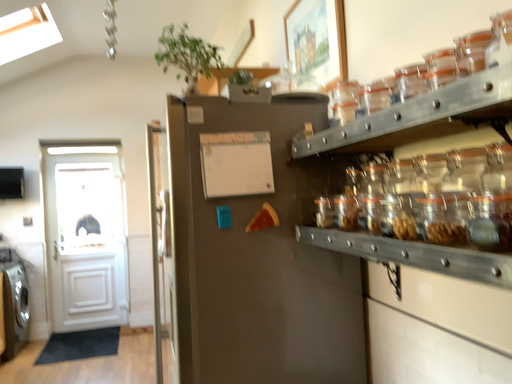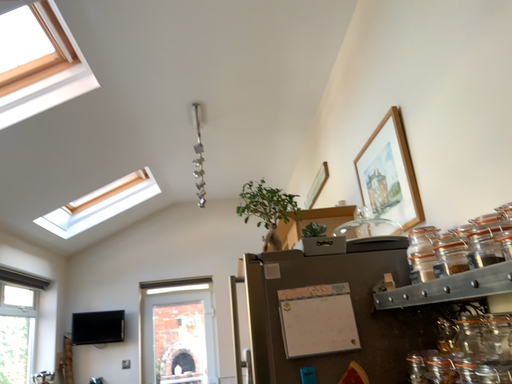
Question: Which way did the camera rotate in the video?

Choices:
 (A) rotated downward
 (B) rotated upward

Answer: (B)